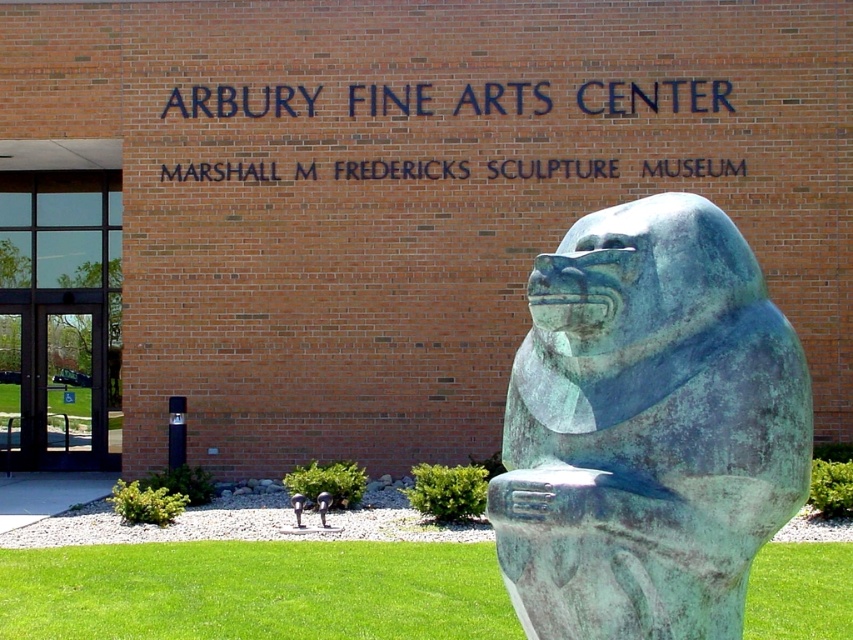
Looking at this image, you are a delivery person trying to move a large wooden crate that is exactly as wide as the clear glass door at left. You need to place it next to the green patina stone statue at center. Based on the scene, will the crate fit in width next to the statue?

The green patina stone statue at center is narrower than the clear glass door at left. Since the crate is as wide as the door, it will be wider than the statue. Therefore, the crate may not fit next to the statue without overlapping or requiring more space.

Consider the image. You are a visitor at the Arbury Fine Arts Center and want to enter through the clear glass door at left. You notice the green patina stone statue at center nearby. Based on their heights, will you have to bend down to pass between them?

The green patina stone statue at center is not as tall as the clear glass door at left, so you will not have to bend down to pass between them since the statue is shorter than the door.